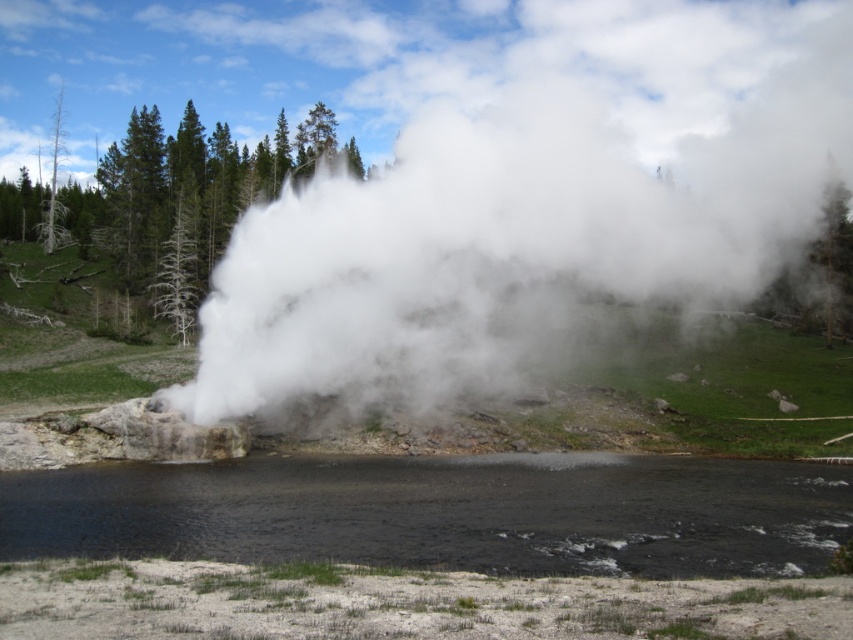
Between white vapor at center and black liquid at center, which one is positioned higher?

white vapor at center

How much distance is there between white vapor at center and black liquid at center?

white vapor at center is 54.54 meters away from black liquid at center.

Is point (642, 237) positioned before point (631, 540)?

No.

Identify the location of white vapor at center. Image resolution: width=853 pixels, height=640 pixels. (514, 232).